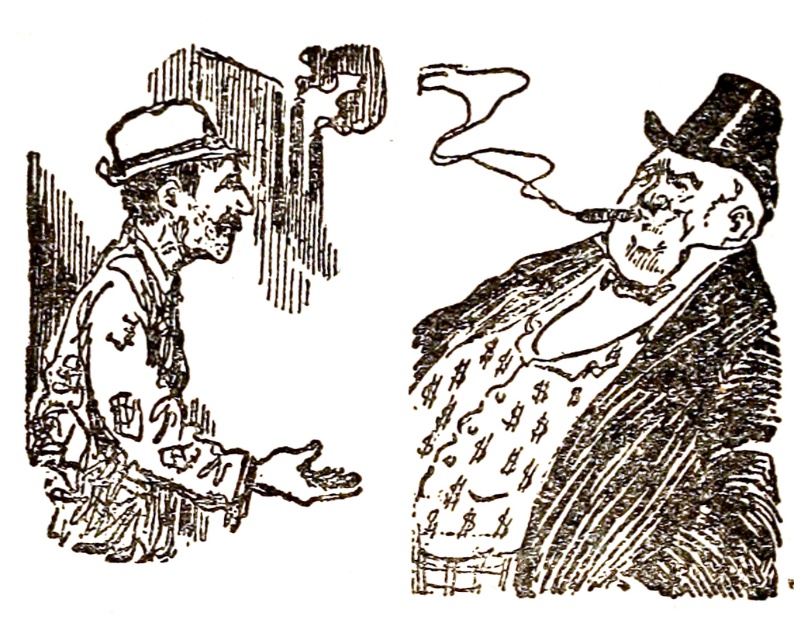
Question: Can you confirm if smooth paper money at right is positioned below black paper hat at left?

Choices:
 (A) yes
 (B) no

Answer: (A)

Question: Does smooth paper money at right have a larger size compared to black paper hat at left?

Choices:
 (A) yes
 (B) no

Answer: (A)

Question: Which of the following is the farthest from the observer?

Choices:
 (A) (727, 241)
 (B) (180, 353)

Answer: (B)

Question: Is smooth paper money at right thinner than black paper hat at left?

Choices:
 (A) yes
 (B) no

Answer: (B)